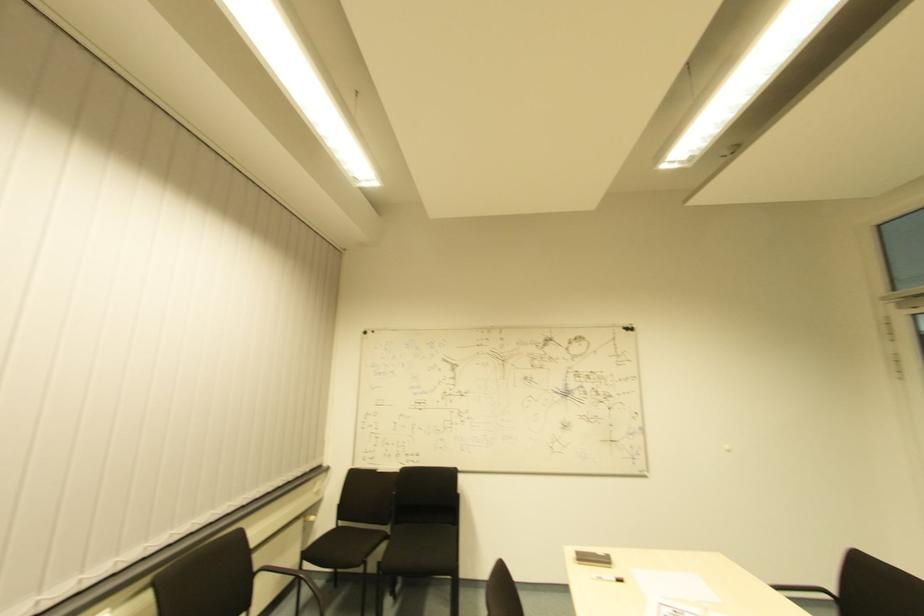
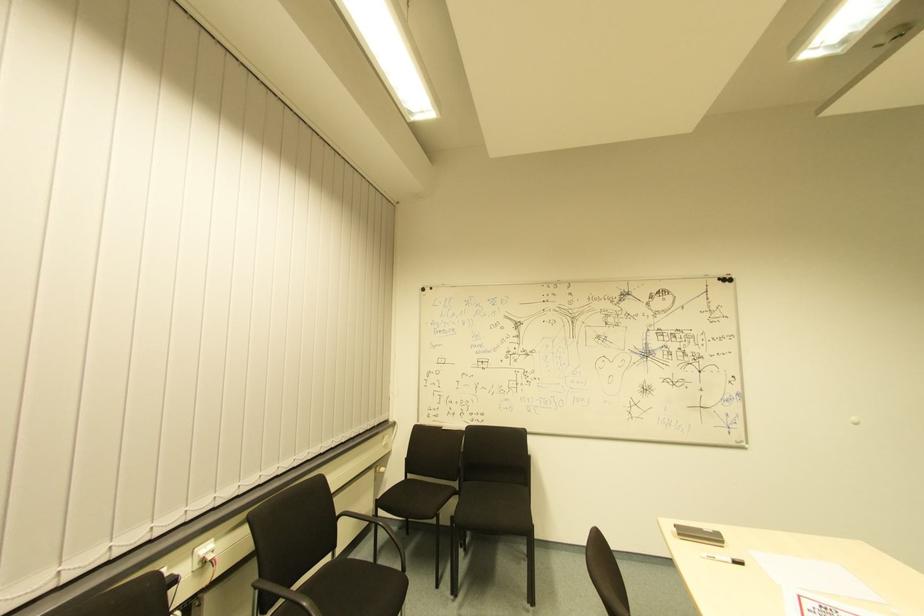
The point at [627,334] is marked in the first image. Where is the corresponding point in the second image?

(725, 286)